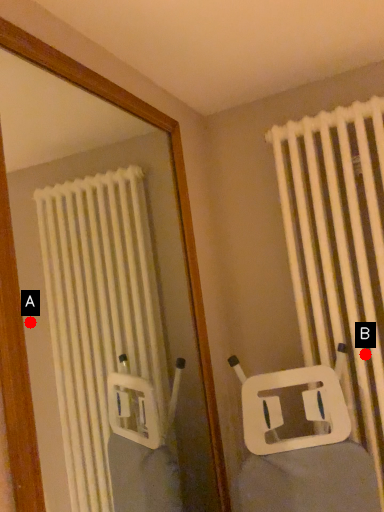
Question: Two points are circled on the image, labeled by A and B beside each circle. Among these points, which one is farthest from the camera?

Choices:
 (A) A is further
 (B) B is further

Answer: (A)